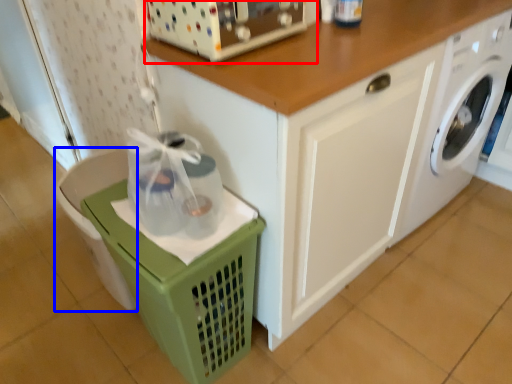
Question: Which object appears farthest to the camera in this image, appliance (highlighted by a red box) or dish washer (highlighted by a blue box)?

Choices:
 (A) appliance
 (B) dish washer

Answer: (B)